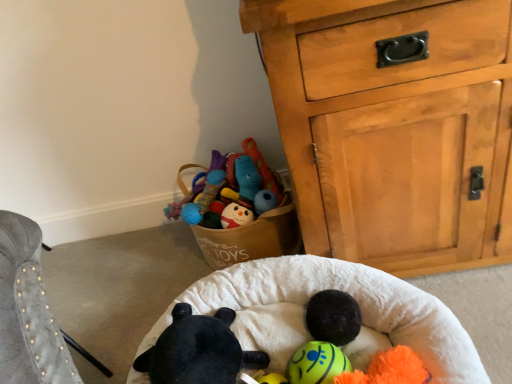
Question: Which direction should I rotate to face neon yellow rubber ball at center, acting as the first toy starting from the right, — up or down?

Choices:
 (A) up
 (B) down

Answer: (B)

Question: Is white soft infant bed at center at the back of neon yellow rubber ball at center, acting as the first toy starting from the right?

Choices:
 (A) no
 (B) yes

Answer: (B)

Question: Does neon yellow rubber ball at center, which is the 2th toy from left to right, appear on the right side of white soft infant bed at center?

Choices:
 (A) no
 (B) yes

Answer: (B)

Question: From the image's perspective, is neon yellow rubber ball at center, which is the 2th toy from left to right, above white soft infant bed at center?

Choices:
 (A) yes
 (B) no

Answer: (A)

Question: Can you confirm if neon yellow rubber ball at center, which is the 2th toy from left to right, is bigger than white soft infant bed at center?

Choices:
 (A) no
 (B) yes

Answer: (A)

Question: Considering the relative sizes of neon yellow rubber ball at center, acting as the first toy starting from the right, and white soft infant bed at center in the image provided, is neon yellow rubber ball at center, acting as the first toy starting from the right, taller than white soft infant bed at center?

Choices:
 (A) no
 (B) yes

Answer: (A)

Question: Is black plush toy at center, acting as the 1th toy starting from the left, wider than neon yellow rubber ball at center, which is the 2th toy from left to right?

Choices:
 (A) yes
 (B) no

Answer: (A)

Question: Is neon yellow rubber ball at center, which is the 2th toy from left to right, inside black plush toy at center, which is the 2th toy in right-to-left order?

Choices:
 (A) no
 (B) yes

Answer: (A)

Question: Is black plush toy at center, acting as the 1th toy starting from the left, oriented towards neon yellow rubber ball at center, which is the 2th toy from left to right?

Choices:
 (A) no
 (B) yes

Answer: (B)

Question: Can you confirm if black plush toy at center, acting as the 1th toy starting from the left, is taller than neon yellow rubber ball at center, which is the 2th toy from left to right?

Choices:
 (A) no
 (B) yes

Answer: (B)

Question: From a real-world perspective, is black plush toy at center, acting as the 1th toy starting from the left, under neon yellow rubber ball at center, acting as the first toy starting from the right?

Choices:
 (A) yes
 (B) no

Answer: (B)

Question: Is black plush toy at center, which is the 2th toy in right-to-left order, placed right next to neon yellow rubber ball at center, which is the 2th toy from left to right?

Choices:
 (A) yes
 (B) no

Answer: (B)

Question: Is black plush toy at center, which is the 2th toy in right-to-left order, completely or partially inside white soft infant bed at center?

Choices:
 (A) yes
 (B) no

Answer: (A)